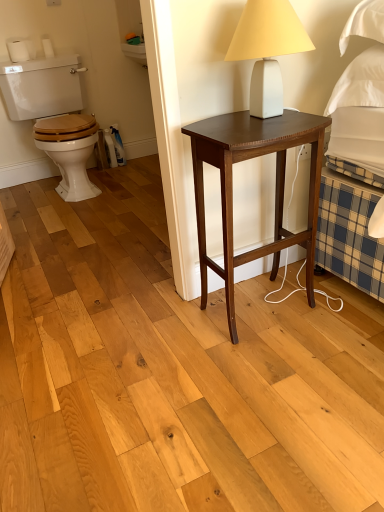
Where is `vacant area located to the right-hand side of dark wood nightstand at center`? The width and height of the screenshot is (384, 512). vacant area located to the right-hand side of dark wood nightstand at center is located at coordinates (346, 315).